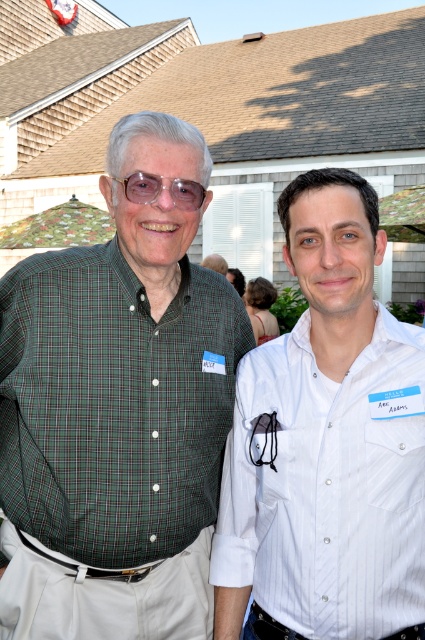
Question: Based on their relative distances, which object is farther from the green plaid shirt at left?

Choices:
 (A) transparent plastic glasses at center
 (B) white pinstripe shirt at center

Answer: (A)

Question: Does white pinstripe shirt at center appear under transparent plastic glasses at center?

Choices:
 (A) yes
 (B) no

Answer: (A)

Question: Which of the following is the closest to the observer?

Choices:
 (A) transparent plastic glasses at center
 (B) green plaid shirt at left

Answer: (A)

Question: Is white pinstripe shirt at center positioned in front of transparent plastic glasses at center?

Choices:
 (A) yes
 (B) no

Answer: (A)

Question: Which point is closer to the camera?

Choices:
 (A) green plaid shirt at left
 (B) white pinstripe shirt at center
 (C) transparent plastic glasses at center

Answer: (B)

Question: Is green plaid shirt at left below transparent plastic glasses at center?

Choices:
 (A) no
 (B) yes

Answer: (B)